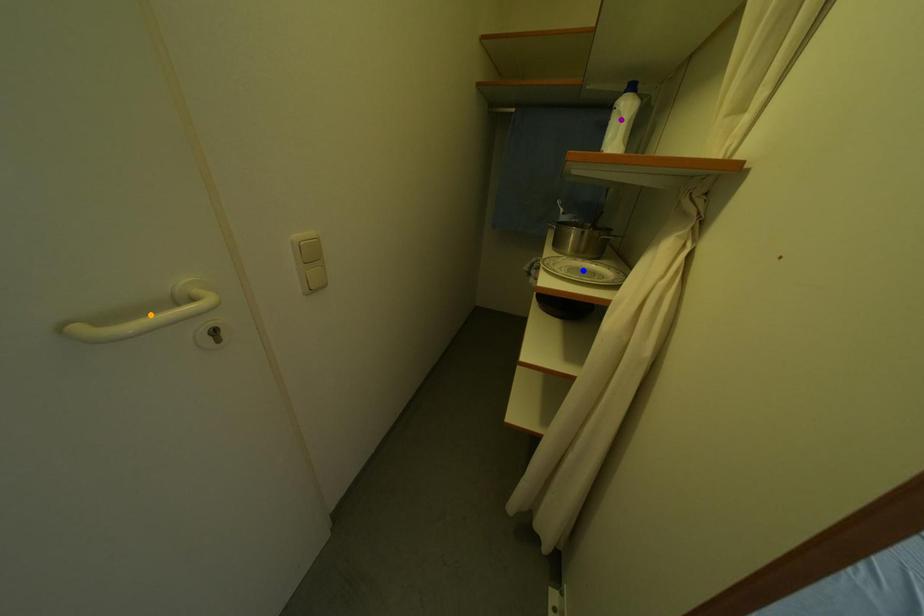
Order these from nearest to farthest:
blue point
orange point
purple point

blue point → purple point → orange point